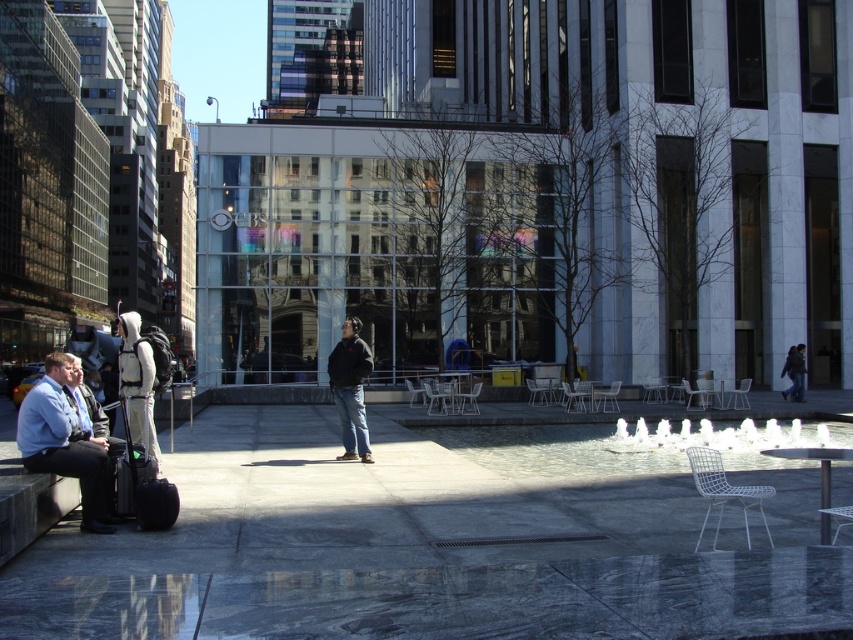
Question: Among these points, which one is farthest from the camera?

Choices:
 (A) (132, 454)
 (B) (74, 452)

Answer: (A)

Question: Does dark blue jeans at center come behind dark gray jacket at center?

Choices:
 (A) yes
 (B) no

Answer: (B)

Question: Based on their relative distances, which object is nearer to the white frothy water at lower right?

Choices:
 (A) dark gray jacket at center
 (B) light blue shirt at lower left

Answer: (B)

Question: In this image, where is black matte suitcase at lower left located relative to dark gray jacket at center?

Choices:
 (A) right
 (B) left

Answer: (B)

Question: Does white frothy water at lower right appear under black matte suitcase at lower left?

Choices:
 (A) no
 (B) yes

Answer: (B)

Question: Estimate the real-world distances between objects in this image. Which object is closer to the light blue shirt at lower left?

Choices:
 (A) dark gray jacket at center
 (B) white frothy water at lower right

Answer: (B)